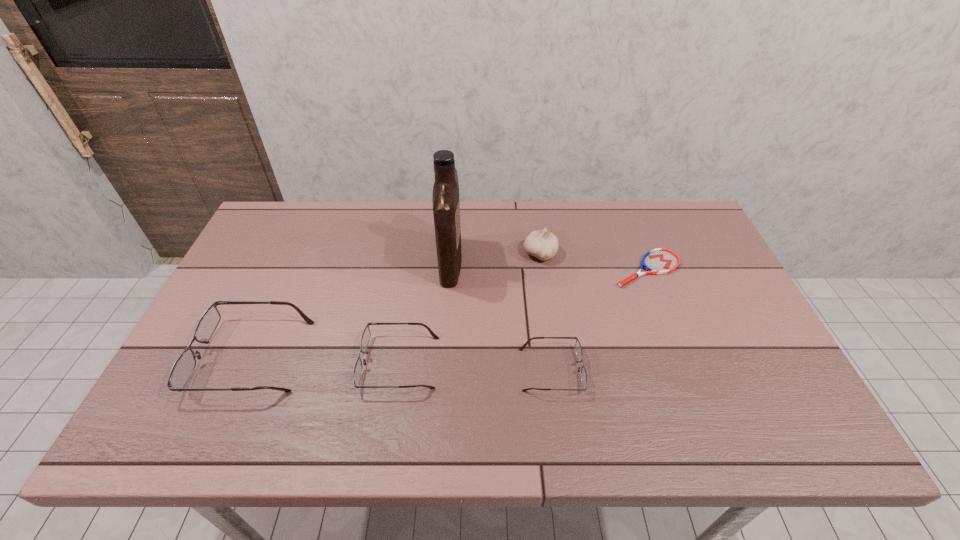
I want to click on object situated at the right edge, so click(657, 261).

Locate an element on the screen. This screenshot has width=960, height=540. object that is positioned at the near left corner is located at coordinates (184, 366).

The height and width of the screenshot is (540, 960). In the image, there is a desktop. Identify the location of vacant space at the far edge. (357, 220).

Locate an element on the screen. Image resolution: width=960 pixels, height=540 pixels. blank area at the near edge is located at coordinates (399, 371).

The height and width of the screenshot is (540, 960). What are the coordinates of `free region at the left edge` in the screenshot? It's located at (281, 254).

Find the location of a particular element. vacant space at the right edge is located at coordinates (701, 294).

Image resolution: width=960 pixels, height=540 pixels. I want to click on vacant area at the far left corner of the desktop, so [309, 221].

The height and width of the screenshot is (540, 960). Find the location of `blank area at the far right corner`. blank area at the far right corner is located at coordinates (695, 218).

The image size is (960, 540). In order to click on free space between the tallest object and the leftmost spectacles in this screenshot , I will do `click(351, 309)`.

Identify the location of unoccupied position between the tallest spectacles and the second spectacles from right to left. (325, 359).